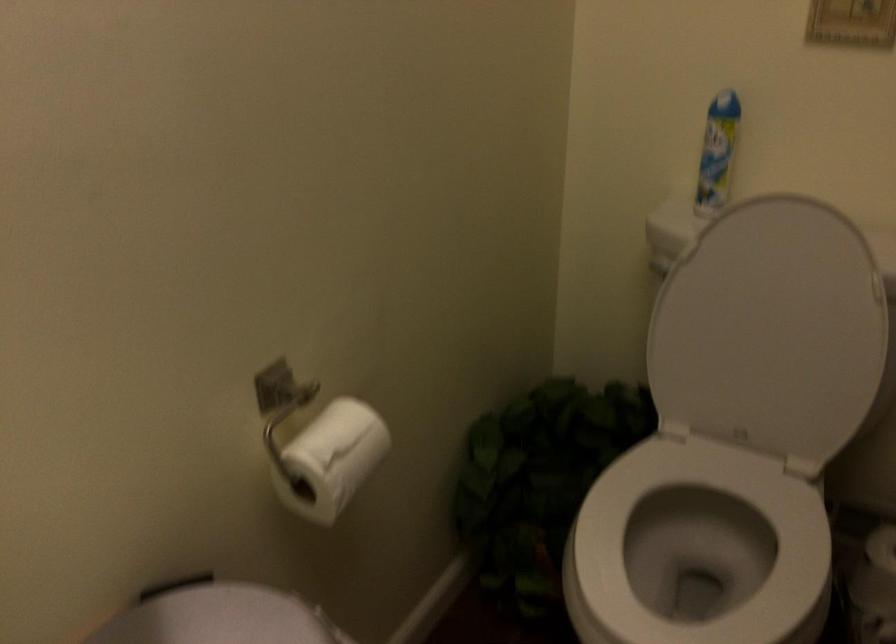
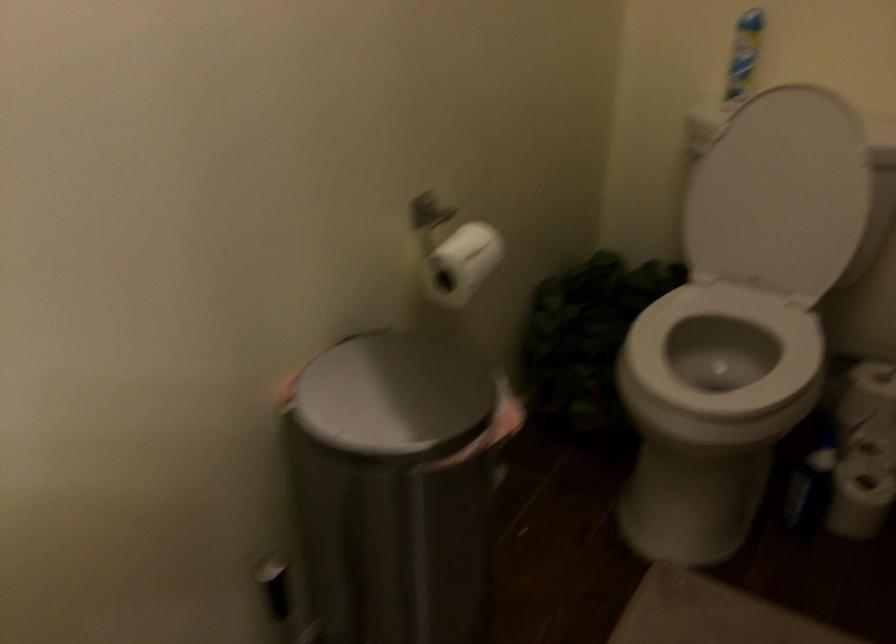
Question: How did the camera likely rotate?

Choices:
 (A) Left
 (B) Right
 (C) Up
 (D) Down

Answer: (D)